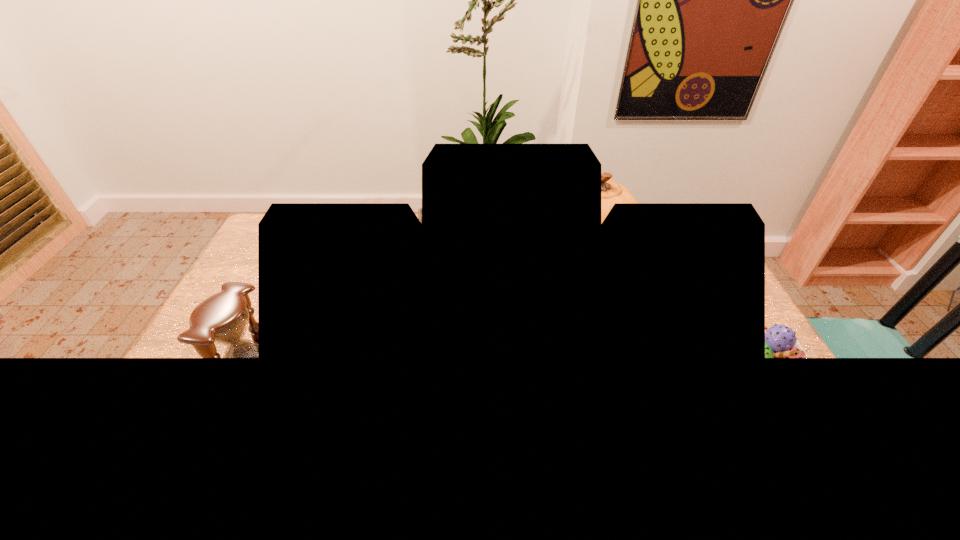
The width and height of the screenshot is (960, 540). I want to click on vacant space located 0.250m on the front face of the third object from left to right, so click(563, 327).

This screenshot has height=540, width=960. Find the location of `vacant space positioned 0.080m on the horn of the second object from left to right`. vacant space positioned 0.080m on the horn of the second object from left to right is located at coordinates (443, 333).

You are a GUI agent. You are given a task and a screenshot of the screen. Output one action in this format:
    pyautogui.click(x=<x>, y=<y>)
    Task: Click on the free space located 0.170m on the horn of the second object from left to right
    This screenshot has width=960, height=540.
    Given the screenshot: What is the action you would take?
    pyautogui.click(x=444, y=357)

The width and height of the screenshot is (960, 540). Identify the location of free spot located 0.310m on the horn of the second object from left to right. (448, 400).

Where is `pumpkin positioned at the far edge`? The height and width of the screenshot is (540, 960). pumpkin positioned at the far edge is located at coordinates pos(611,192).

Locate an element on the screen. The image size is (960, 540). phonograph_record located at the far edge is located at coordinates (419, 210).

What are the coordinates of `hourglass present at the near edge` in the screenshot? It's located at (222, 318).

Where is `icecream present at the near edge`? icecream present at the near edge is located at coordinates (780, 341).

Where is `object that is at the left edge`? object that is at the left edge is located at coordinates (222, 318).

Identify the location of object situated at the right edge. (780, 341).